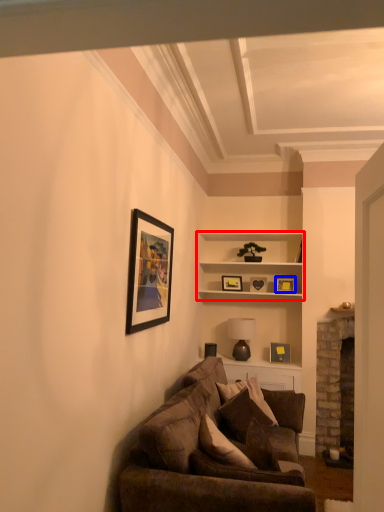
Question: Which object appears farthest to the camera in this image, shelf (highlighted by a red box) or picture frame (highlighted by a blue box)?

Choices:
 (A) shelf
 (B) picture frame

Answer: (B)